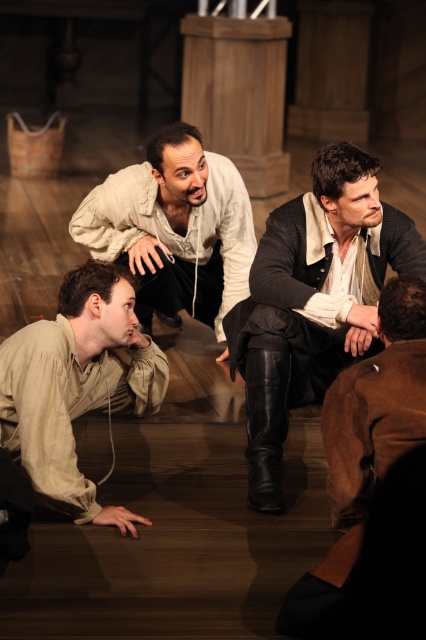
Question: Based on their relative distances, which object is nearer to the matte beige shirt at lower left?

Choices:
 (A) brown leather jacket at lower right
 (B) leather boots at center
 (C) light beige leather jacket at center

Answer: (B)

Question: In this image, where is leather boots at center located relative to light beige leather jacket at center?

Choices:
 (A) left
 (B) right

Answer: (B)

Question: Is leather boots at center positioned behind light beige leather jacket at center?

Choices:
 (A) yes
 (B) no

Answer: (B)

Question: Which point is farther from the camera taking this photo?

Choices:
 (A) (236, 310)
 (B) (336, 547)

Answer: (A)

Question: Based on their relative distances, which object is nearer to the matte beige shirt at lower left?

Choices:
 (A) light beige leather jacket at center
 (B) brown leather jacket at lower right

Answer: (B)

Question: Can you confirm if light beige leather jacket at center is thinner than brown leather jacket at lower right?

Choices:
 (A) no
 (B) yes

Answer: (A)